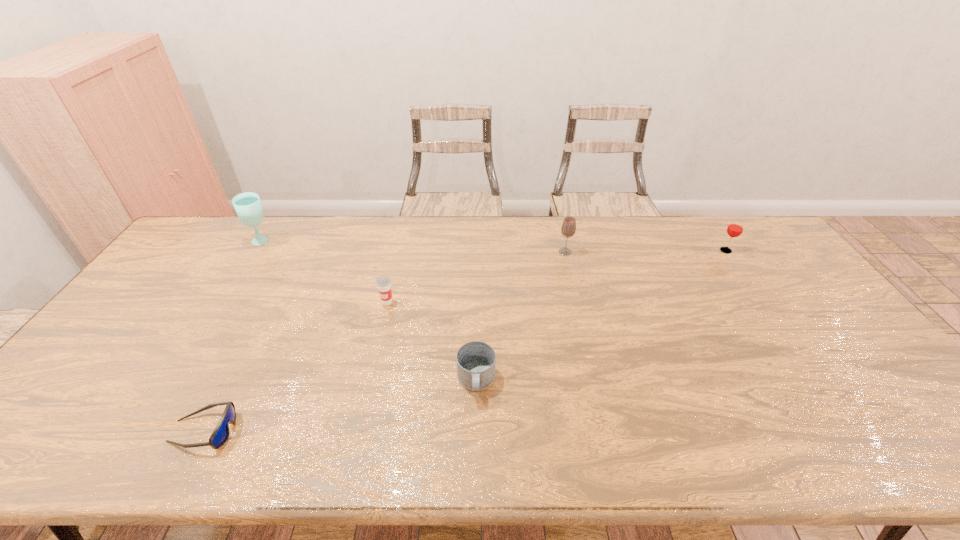
In the image, there is a desktop. Where is `free space at the right edge`? free space at the right edge is located at coordinates (892, 406).

You are a GUI agent. You are given a task and a screenshot of the screen. Output one action in this format:
    pyautogui.click(x=<x>, y=<y>)
    Task: Click on the vacant space at the far right corner of the desktop
    This screenshot has height=540, width=960.
    Given the screenshot: What is the action you would take?
    pyautogui.click(x=739, y=218)

In the image, there is a desktop. Identify the location of vacant space at the near right corner. (904, 438).

Locate an element on the screen. free space between the fourth object from right to left and the nearest object is located at coordinates (296, 367).

At what (x,y) coordinates should I click in order to perform the action: click on empty location between the third nearest object and the fifth farthest object. Please return your answer as a coordinate pair (x, y). Looking at the image, I should click on tap(432, 341).

You are a GUI agent. You are given a task and a screenshot of the screen. Output one action in this format:
    pyautogui.click(x=<x>, y=<y>)
    Task: Click on the free space that is in between the mug and the rightmost glass
    Image resolution: width=960 pixels, height=540 pixels.
    Given the screenshot: What is the action you would take?
    pyautogui.click(x=601, y=316)

Where is `free space between the fifth farthest object and the leftmost object`? free space between the fifth farthest object and the leftmost object is located at coordinates (370, 312).

At what (x,y) coordinates should I click in order to perform the action: click on vacant point located between the tallest object and the second glass from left to right. Please return your answer as a coordinate pair (x, y). The image size is (960, 540). Looking at the image, I should click on (414, 247).

Where is `free space between the shortest object and the second glass from right to left`? This screenshot has width=960, height=540. free space between the shortest object and the second glass from right to left is located at coordinates (384, 341).

At what (x,y) coordinates should I click in order to perform the action: click on empty space between the cup and the rightmost glass. Please return your answer as a coordinate pair (x, y). The width and height of the screenshot is (960, 540). Looking at the image, I should click on (557, 276).